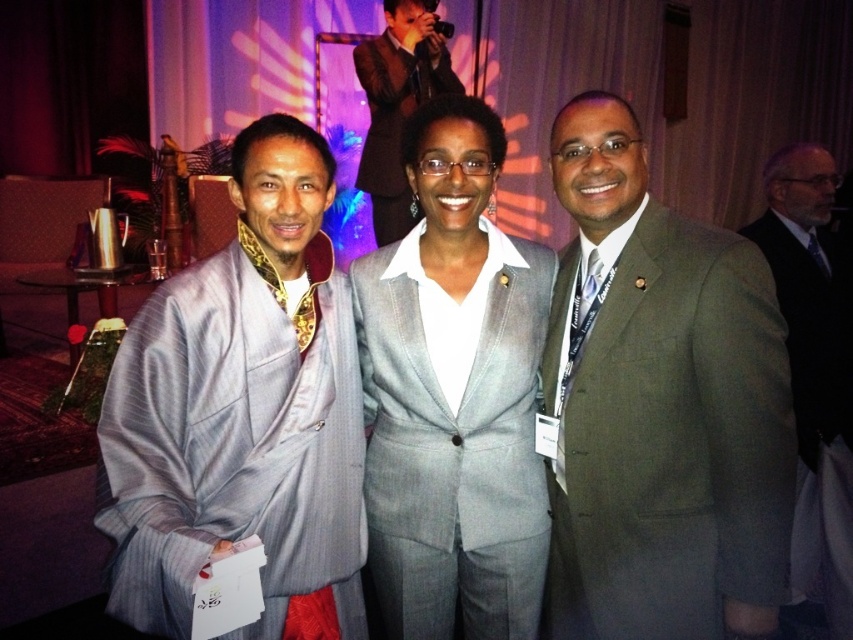
You are organizing a charity event and need to decide which item to place on a display table that can only accommodate one of the two items. Based on their sizes, which item from the black wool suit at right and the black silk tie at right would you choose?

The black wool suit at right is bigger than the black silk tie at right, so you should choose the black wool suit at right to place on the display table since it takes up more space.

You are standing in front of the group of three individuals at the formal event. You want to determine which of the two points, point (523, 360) or point (830, 406), is closer to you. Based on the scene description, which point is nearer?

Point (523, 360) is closer to the viewer than point (830, 406).

You are a photographer at the event and want to position yourself such that the black wool suit at right is in the center of your camera frame. What direction should you move relative to the current camera position?

The black wool suit at right is currently positioned at coordinates point [811,372]. To center it in the frame, you should move the camera to the left and upwards to adjust the angle so that the coordinates align with the center point of the frame.